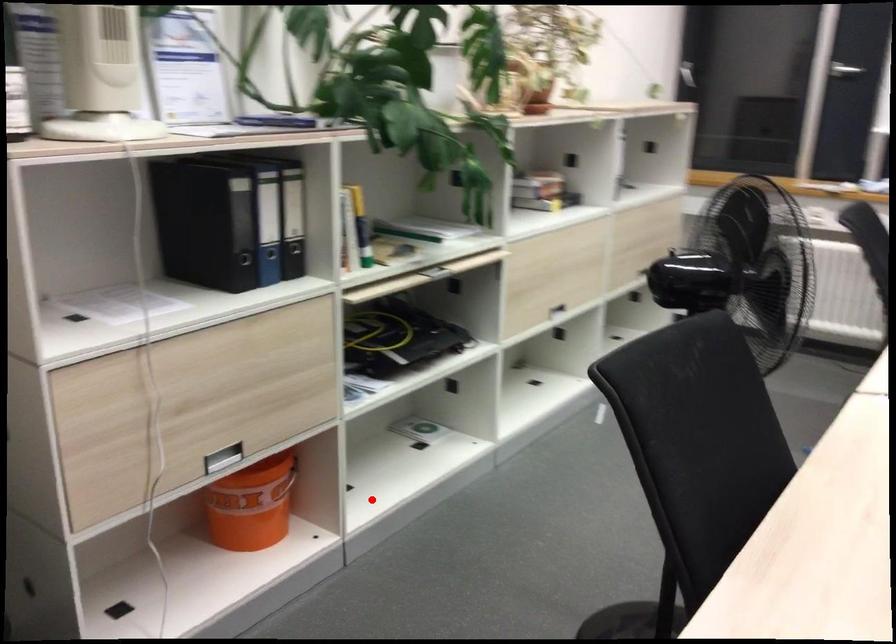
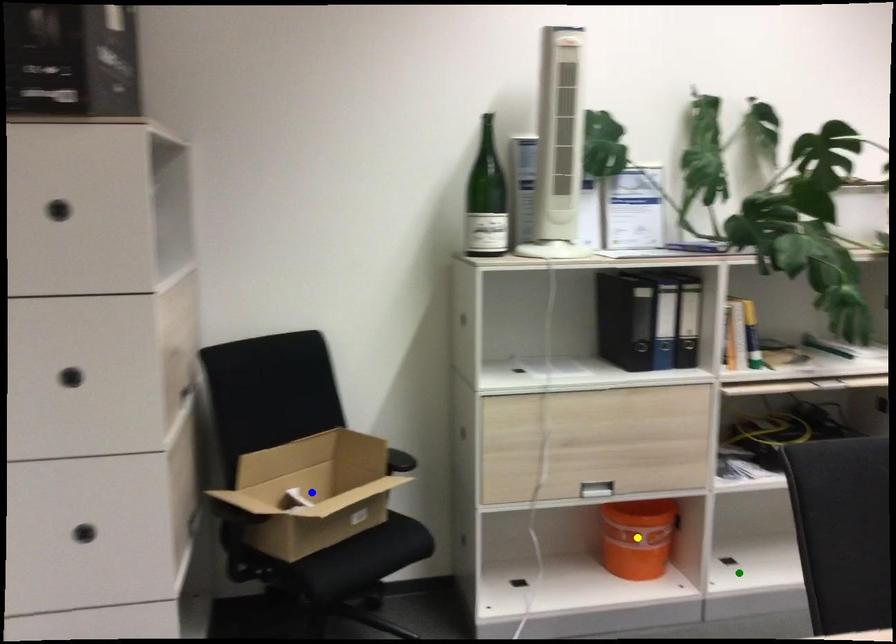
Question: I am providing you with two images of the same scene from different viewpoints. A red point is marked on the first image. You are given multiple points on the second image. Which mark in image 2 goes with the point in image 1?

Choices:
 (A) yellow point
 (B) blue point
 (C) green point

Answer: (C)